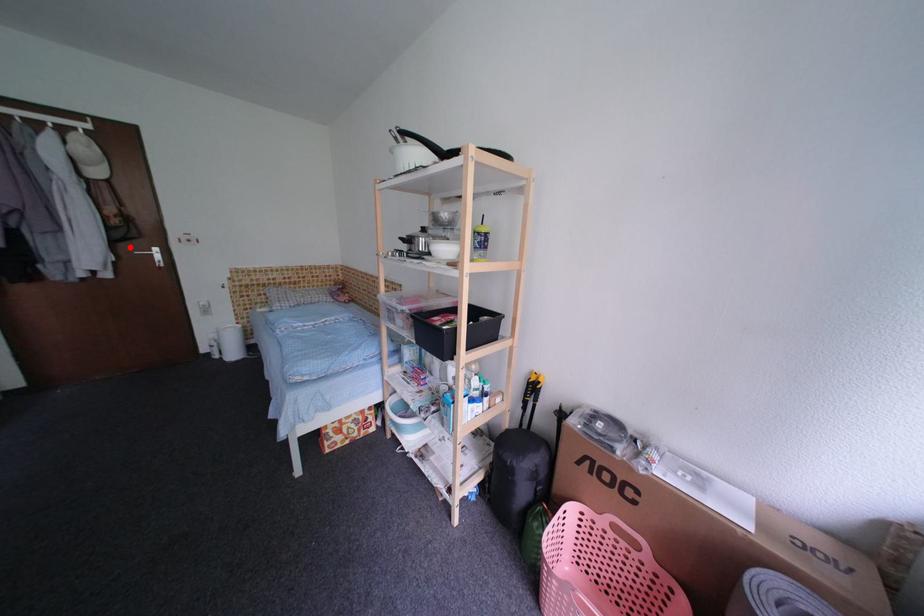
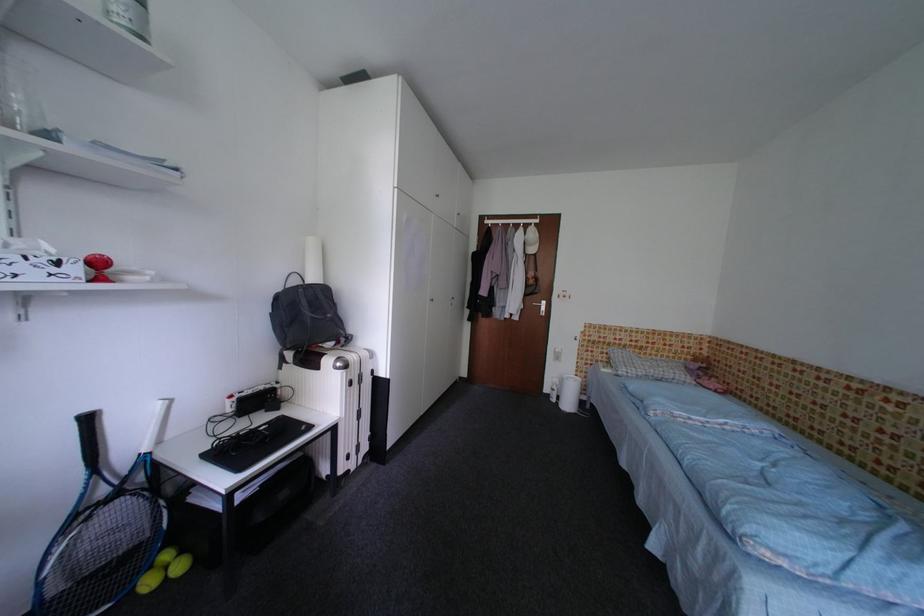
Question: A red point is marked in image1. In image2, is the corresponding 3D point closer to the camera or farther? Reply with the corresponding letter.

Choices:
 (A) The corresponding 3D point is closer.
 (B) The corresponding 3D point is farther.

Answer: (A)